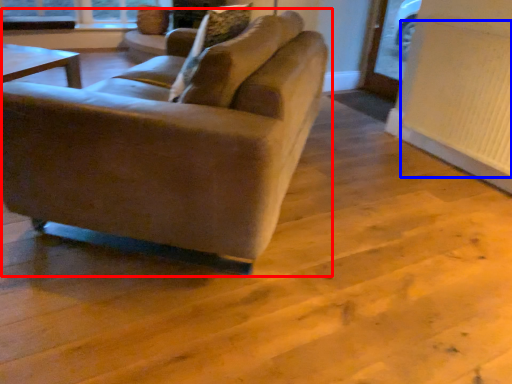
Question: Which point is further to the camera, studio couch (highlighted by a red box) or radiator (highlighted by a blue box)?

Choices:
 (A) studio couch
 (B) radiator

Answer: (B)